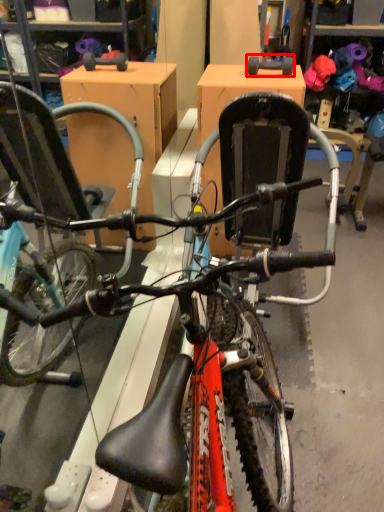
Question: Where is wheel (annotated by the red box) located in relation to bicycle in the image?

Choices:
 (A) left
 (B) right

Answer: (B)